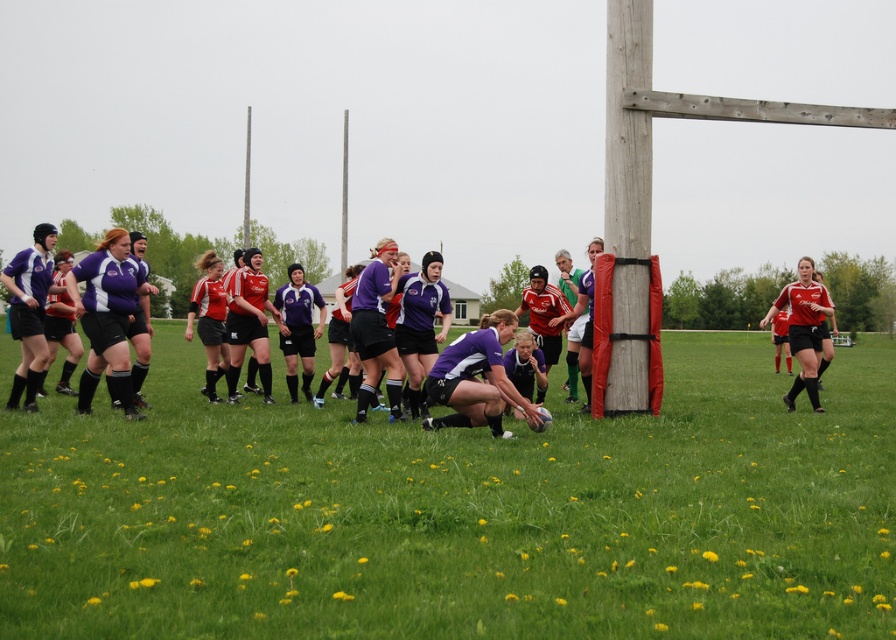
The image size is (896, 640). I want to click on purple matte jersey at center, so click(x=476, y=378).

Does purple matte jersey at center appear over matte red jersey at right?

No, purple matte jersey at center is not above matte red jersey at right.

Does point (500, 376) come farther from viewer compared to point (791, 333)?

No, it is not.

You are a GUI agent. You are given a task and a screenshot of the screen. Output one action in this format:
    pyautogui.click(x=<x>, y=<y>)
    Task: Click on the purple matte jersey at center
    Image resolution: width=896 pixels, height=640 pixels.
    Given the screenshot: What is the action you would take?
    pyautogui.click(x=476, y=378)

Is green grass at center above purple matte jersey at center?

No, green grass at center is not above purple matte jersey at center.

Does green grass at center lie in front of purple matte jersey at center?

Yes, green grass at center is in front of purple matte jersey at center.

Identify the location of green grass at center. (461, 513).

At what (x,y) coordinates should I click in order to perform the action: click on green grass at center. Please return your answer as a coordinate pair (x, y). Looking at the image, I should click on (461, 513).

The height and width of the screenshot is (640, 896). Describe the element at coordinates (461, 513) in the screenshot. I see `green grass at center` at that location.

Does point (840, 460) come in front of point (813, 337)?

That is True.

At what (x,y) coordinates should I click in order to perform the action: click on green grass at center. Please return your answer as a coordinate pair (x, y). Looking at the image, I should click on (461, 513).